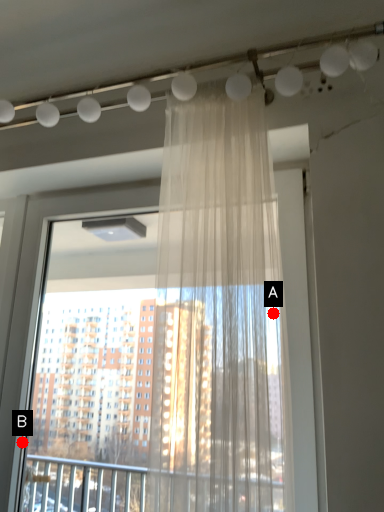
Question: Two points are circled on the image, labeled by A and B beside each circle. Which of the following is the closest to the observer?

Choices:
 (A) A is closer
 (B) B is closer

Answer: (A)